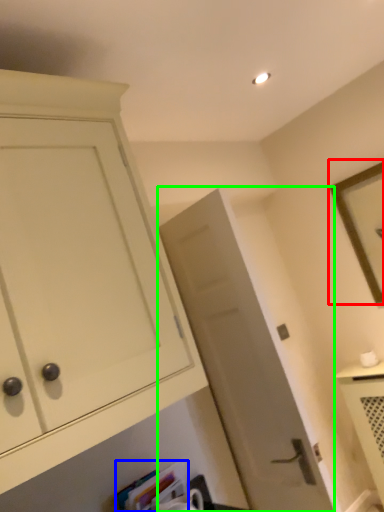
Question: Which object is the closest to the picture frame (highlighted by a red box)? Choose among these: book (highlighted by a blue box) or door (highlighted by a green box).

Choices:
 (A) book
 (B) door

Answer: (B)